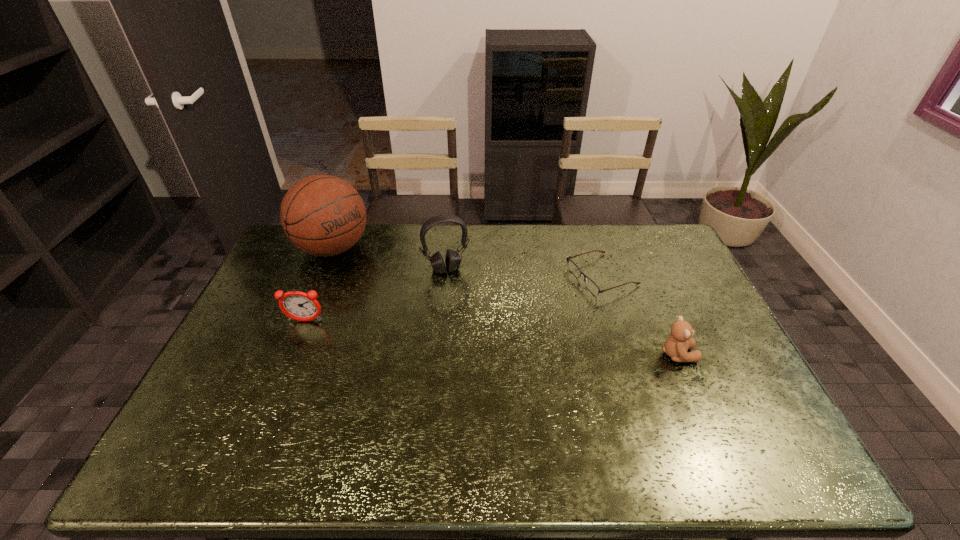
The height and width of the screenshot is (540, 960). I want to click on free space located on the front-facing side of the fourth shortest object, so tap(460, 301).

Find the location of a particular element. free space located on the side with brand label of the basketball is located at coordinates (405, 300).

In order to click on free location located 0.230m on the side with brand label of the basketball in this screenshot , I will do `click(398, 295)`.

Find the location of a particular element. This screenshot has height=540, width=960. vacant space located 0.250m on the side with brand label of the basketball is located at coordinates (403, 298).

This screenshot has height=540, width=960. Identify the location of vacant space positioned on the front-facing side of the shortest object. (511, 308).

You are a GUI agent. You are given a task and a screenshot of the screen. Output one action in this format:
    pyautogui.click(x=<x>, y=<y>)
    Task: Click on the free space located 0.160m on the front-facing side of the shortest object
    
    Given the screenshot: What is the action you would take?
    pyautogui.click(x=531, y=301)

Find the location of a particular element. The width and height of the screenshot is (960, 540). vacant area situated 0.050m on the front-facing side of the shortest object is located at coordinates (560, 291).

You are a GUI agent. You are given a task and a screenshot of the screen. Output one action in this format:
    pyautogui.click(x=<x>, y=<y>)
    Task: Click on the headset located in the far edge section of the desktop
    The height and width of the screenshot is (540, 960).
    Given the screenshot: What is the action you would take?
    pyautogui.click(x=452, y=260)

Identify the location of basketball located in the far edge section of the desktop. (323, 215).

The height and width of the screenshot is (540, 960). Find the location of `spectacles located in the far edge section of the desktop`. spectacles located in the far edge section of the desktop is located at coordinates (575, 270).